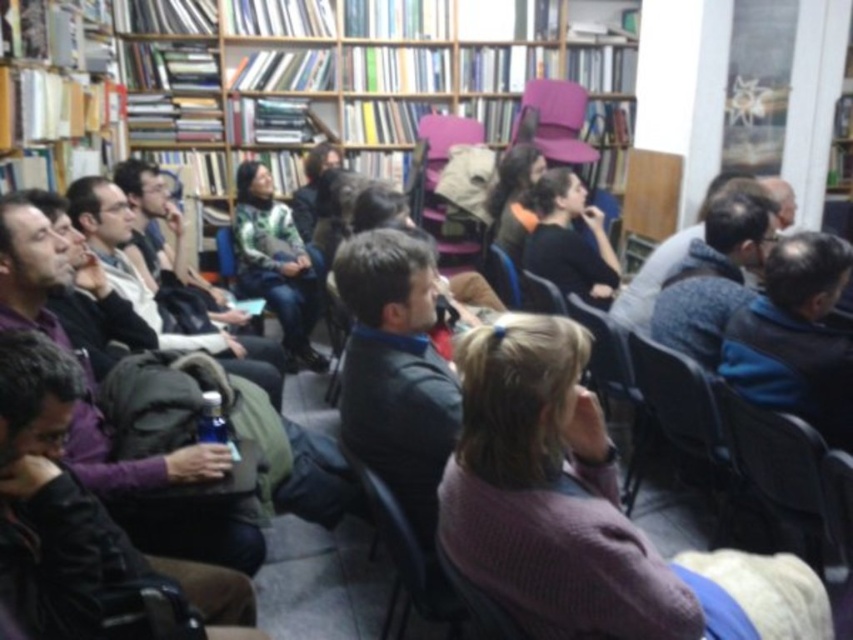
Question: Where is wooden bookcase at upper center located in relation to green textured sweater at center in the image?

Choices:
 (A) right
 (B) left

Answer: (A)

Question: Does green textured sweater at center appear under pink fabric chair at upper center?

Choices:
 (A) no
 (B) yes

Answer: (B)

Question: Which object is positioned farthest from the wooden chair at center?

Choices:
 (A) green textured sweater at center
 (B) dark brown leather jacket at lower left

Answer: (B)

Question: From the image, what is the correct spatial relationship of dark brown leather jacket at lower left in relation to pink fabric chair at upper center?

Choices:
 (A) below
 (B) above

Answer: (A)

Question: Among these objects, which one is farthest from the camera?

Choices:
 (A) wooden bookcase at upper center
 (B) green textured sweater at center
 (C) dark brown leather jacket at lower left
 (D) purple fabric chair at center

Answer: (A)

Question: Which point is closer to the camera taking this photo?

Choices:
 (A) (62, 355)
 (B) (257, 316)
 (C) (428, 154)

Answer: (A)